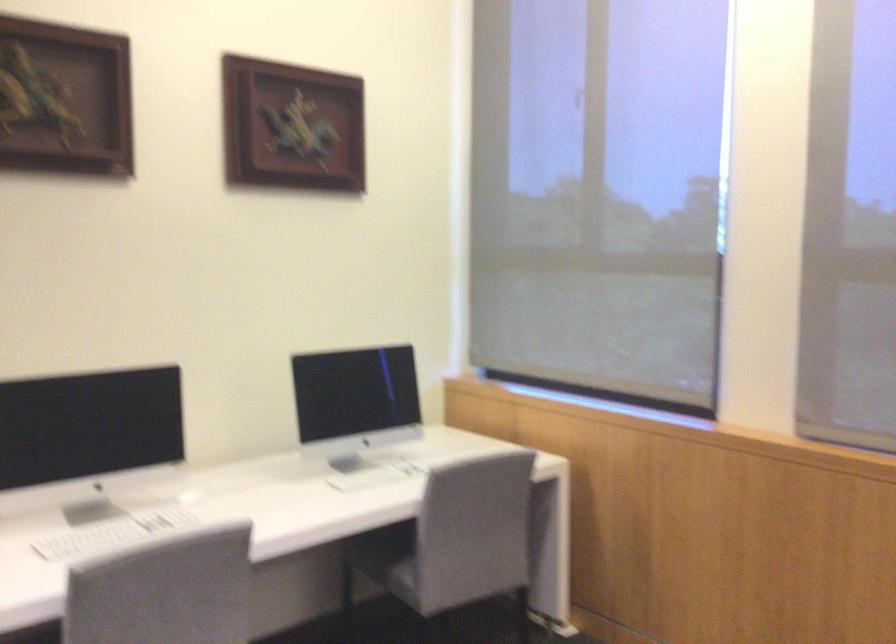
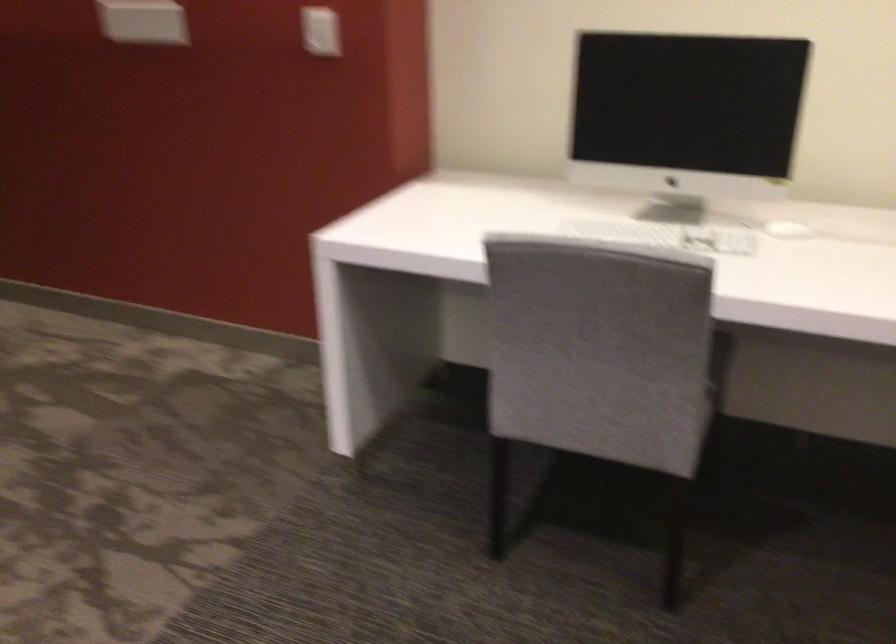
Find the pixel in the second image that matches (207,498) in the first image.

(786, 230)